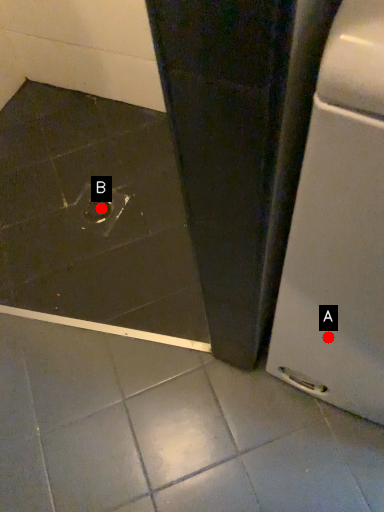
Question: Two points are circled on the image, labeled by A and B beside each circle. Among these points, which one is farthest from the camera?

Choices:
 (A) A is further
 (B) B is further

Answer: (B)